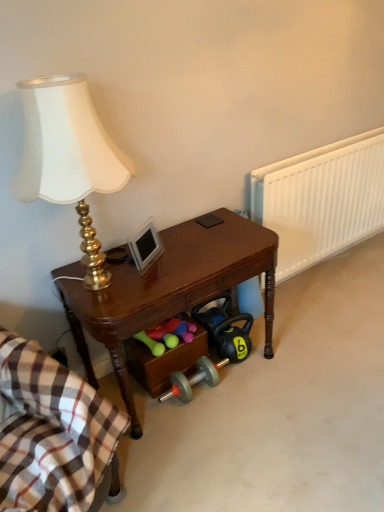
The height and width of the screenshot is (512, 384). I want to click on vacant point to the right of gold metallic lamp at left, so click(x=198, y=249).